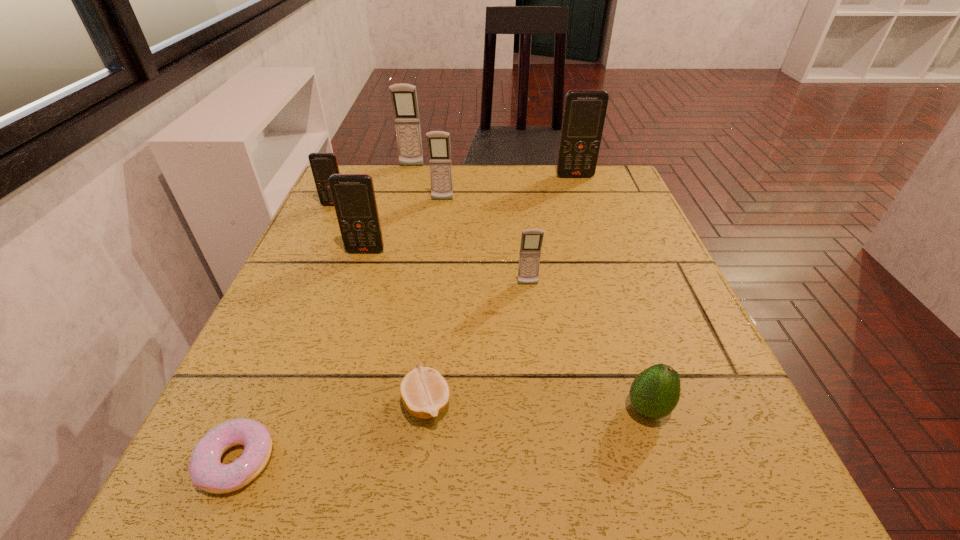
In order to click on the rightmost gray cellular telephone in this screenshot , I will do `click(531, 240)`.

Where is `the nearest gray cellular telephone`? the nearest gray cellular telephone is located at coordinates (531, 240).

Locate an element on the screen. The image size is (960, 540). avocado is located at coordinates (655, 392).

The width and height of the screenshot is (960, 540). I want to click on green avocado, so click(x=655, y=392).

Find the location of a particular element. yellow lemon is located at coordinates (425, 393).

The image size is (960, 540). I want to click on doughnut, so click(x=206, y=471).

Find the location of a particular element. This screenshot has height=540, width=960. vacant region located on the front-facing side of the farthest object is located at coordinates (393, 242).

At what (x,y) coordinates should I click in order to perform the action: click on free space located 0.290m on the screen of the rightmost orange cellular telephone. Please return your answer as a coordinate pair (x, y). Image resolution: width=960 pixels, height=540 pixels. Looking at the image, I should click on (598, 245).

Find the location of `vacant region located on the front-facing side of the seventh nearest object`. vacant region located on the front-facing side of the seventh nearest object is located at coordinates (431, 292).

What are the coordinates of `vacant space located 0.320m on the screen of the fifth farthest object` in the screenshot? It's located at (324, 382).